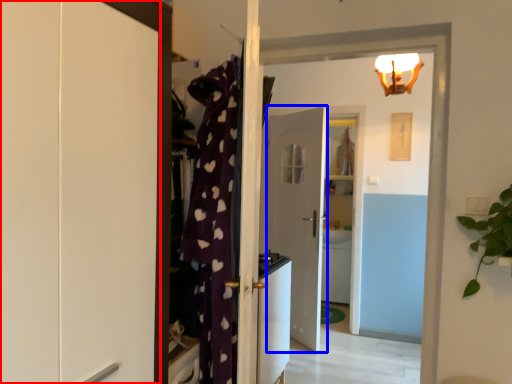
Question: Which object is closer to the camera taking this photo, cabinetry (highlighted by a red box) or door (highlighted by a blue box)?

Choices:
 (A) cabinetry
 (B) door

Answer: (A)